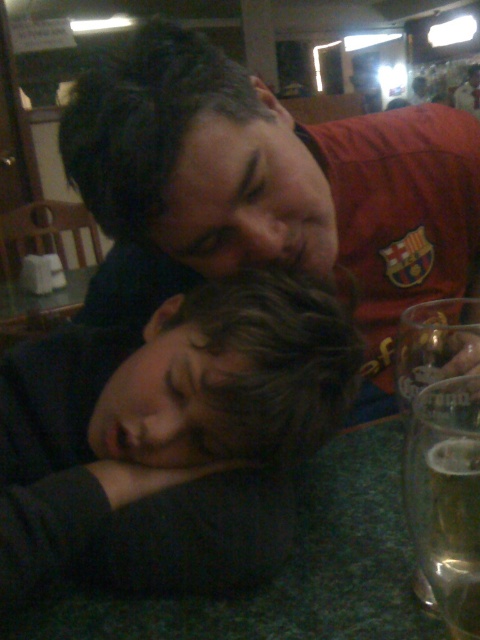
You are a waiter in a restaurant and need to place a new order of a clear glass beer at lower right on the table where the matte red shirt at center is located. Considering their sizes, will the beer fit comfortably next to the shirt without spilling?

The matte red shirt at center is larger in size than the clear glass beer at lower right. Since the shirt takes up more space, there should be enough room to place the beer next to it without causing any issues or spills.

In the image, there is a dark brown hair at lower left. Can you tell me the exact coordinates where it is located?

The dark brown hair at lower left is located at coordinates point (x=168, y=436).